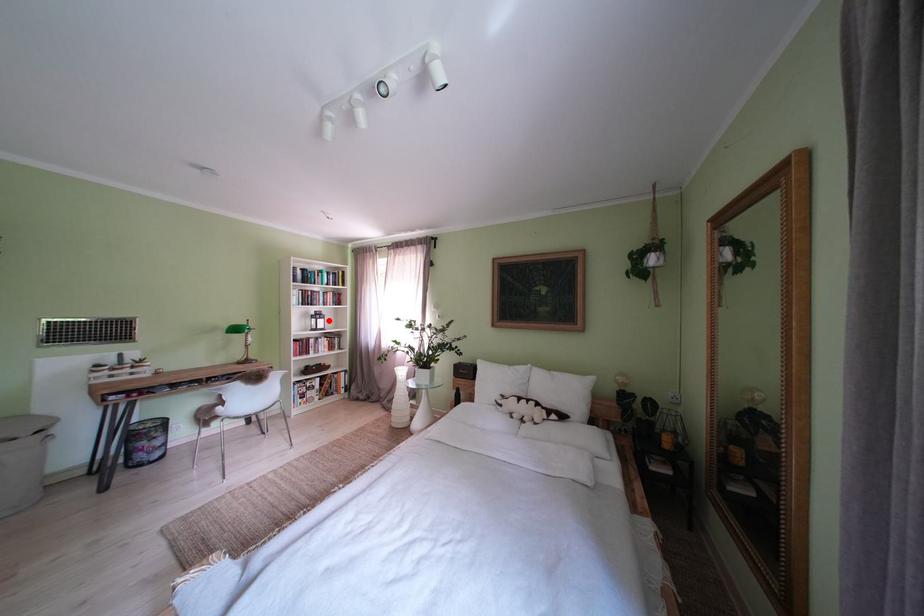
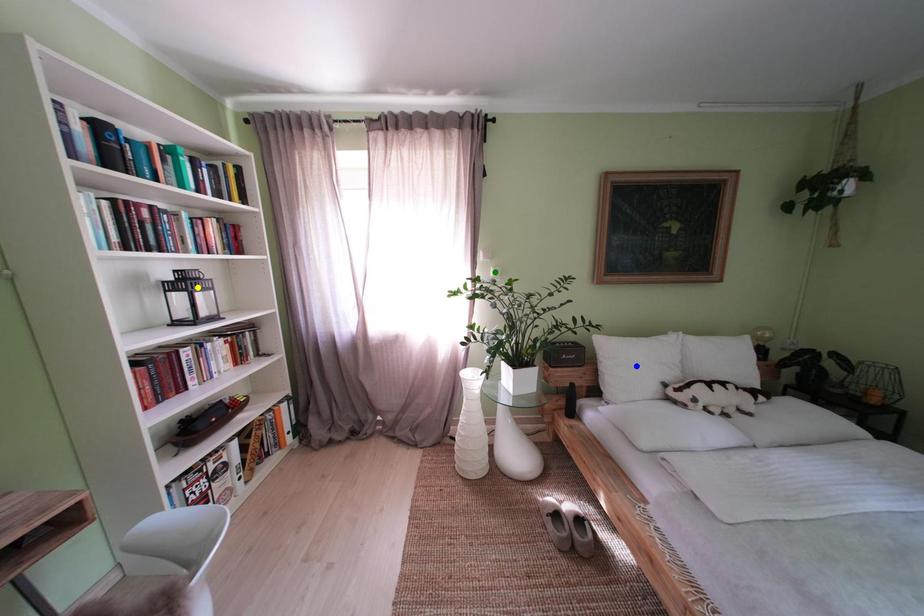
Question: I am providing you with two images of the same scene from different viewpoints. A red point is marked on the first image. You are given multiple points on the second image. Which spot in image 2 lines up with the point in image 1?

Choices:
 (A) blue point
 (B) green point
 (C) yellow point

Answer: (C)